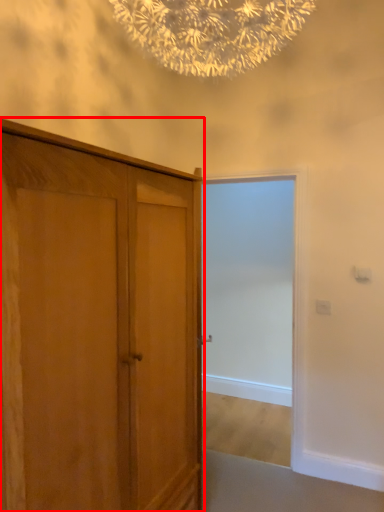
Question: In this image, where is cupboard (annotated by the red box) located relative to screen door?

Choices:
 (A) left
 (B) right

Answer: (A)